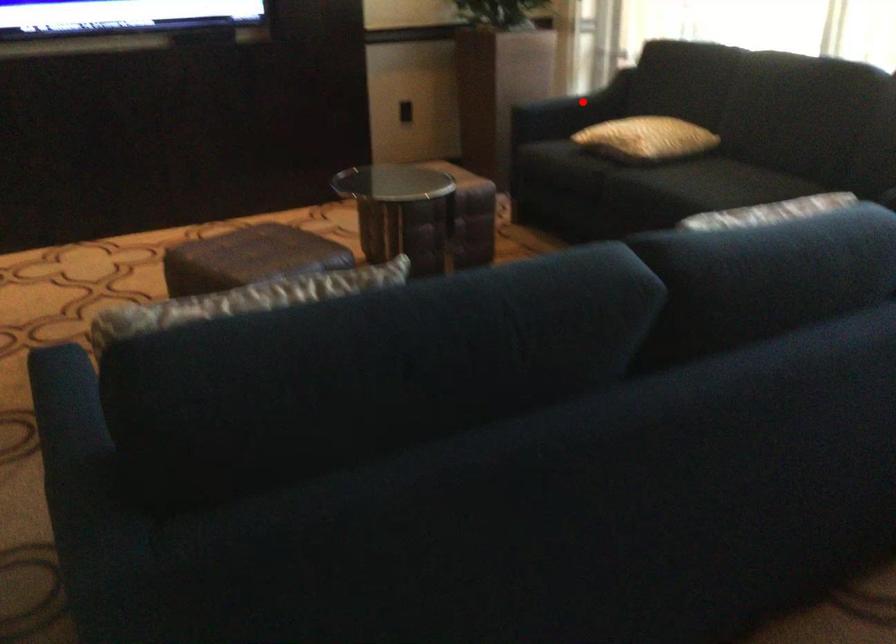
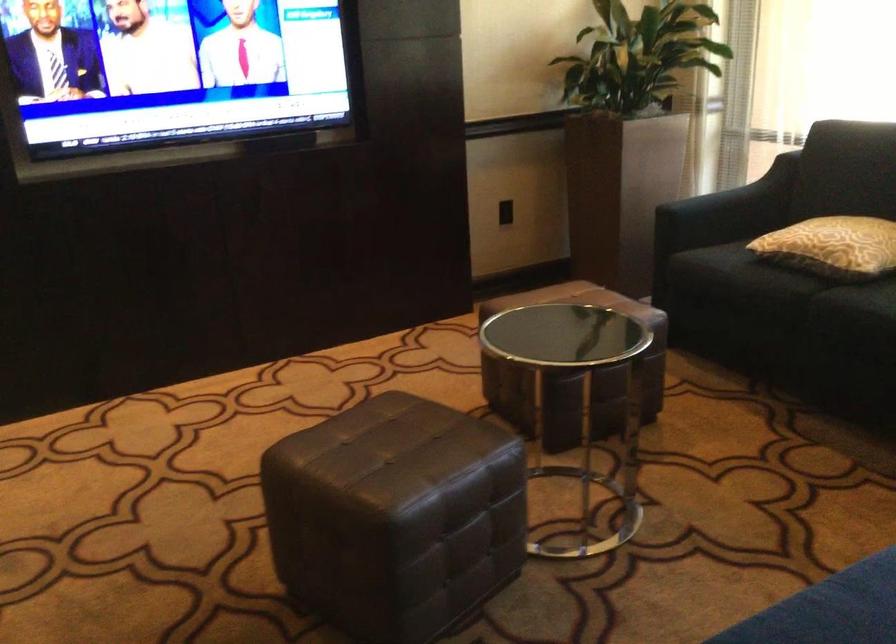
Question: I am providing you with two images of the same scene from different viewpoints. In image1, a red point is highlighted. Considering the same 3D point in image2, which of the following is correct?

Choices:
 (A) It is closer
 (B) It is farther

Answer: (A)